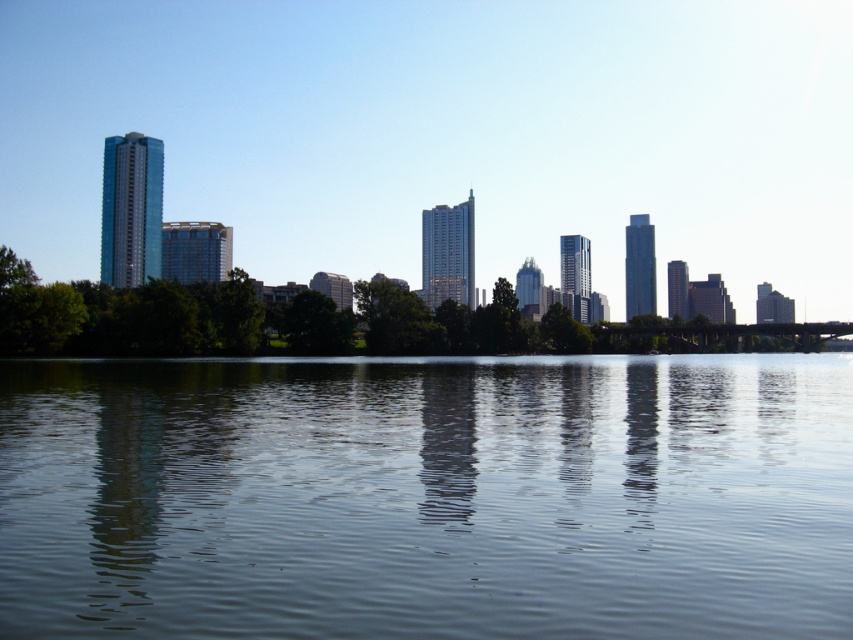
Can you confirm if clear water at center is positioned to the right of green leafy tree at center?

Yes, clear water at center is to the right of green leafy tree at center.

Who is more forward, (770,458) or (306,328)?

Point (770,458) is more forward.

At what (x,y) coordinates should I click in order to perform the action: click on clear water at center. Please return your answer as a coordinate pair (x, y). The width and height of the screenshot is (853, 640). Looking at the image, I should click on (427, 497).